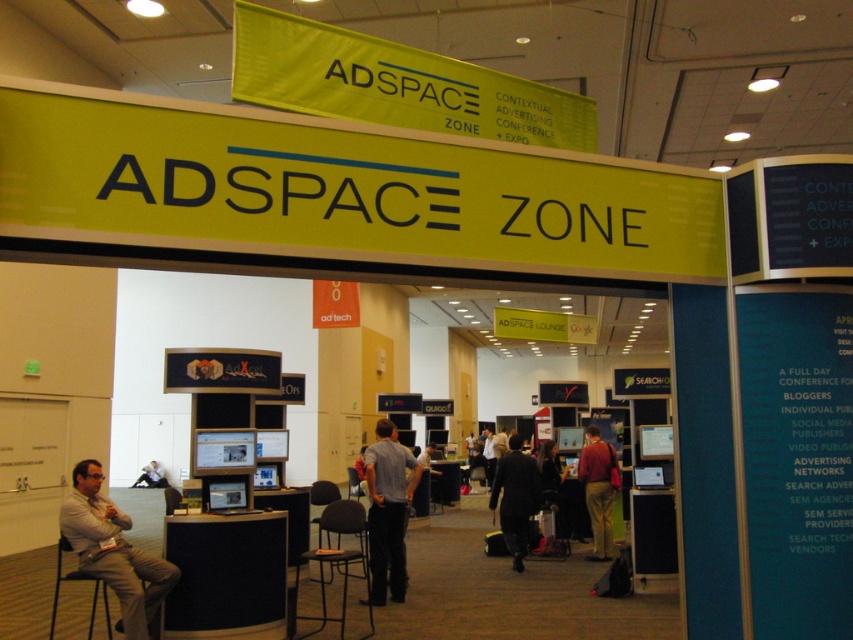
Is light brown fabric pants at lower left taller than light brown leather jacket at lower left?

Yes, light brown fabric pants at lower left is taller than light brown leather jacket at lower left.

Is light brown fabric pants at lower left positioned behind light brown leather jacket at lower left?

No, it is in front of light brown leather jacket at lower left.

Is point (151, 625) closer to camera compared to point (149, 483)?

That is True.

Locate an element on the screen. The height and width of the screenshot is (640, 853). light brown fabric pants at lower left is located at coordinates (113, 552).

Is point (123, 545) positioned before point (368, 532)?

Yes, it is.

Which is below, light brown fabric pants at lower left or gray cotton shirt at center?

gray cotton shirt at center is lower down.

Between point (77, 502) and point (390, 470), which one is positioned in front?

Positioned in front is point (77, 502).

Identify the location of light brown fabric pants at lower left. This screenshot has width=853, height=640. (113, 552).

Does dark suit at center have a greater height compared to dark gray suit at center?

Indeed, dark suit at center has a greater height compared to dark gray suit at center.

Can you confirm if dark suit at center is positioned to the right of dark gray suit at center?

No, dark suit at center is not to the right of dark gray suit at center.

Locate an element on the screen. Image resolution: width=853 pixels, height=640 pixels. dark suit at center is located at coordinates (515, 497).